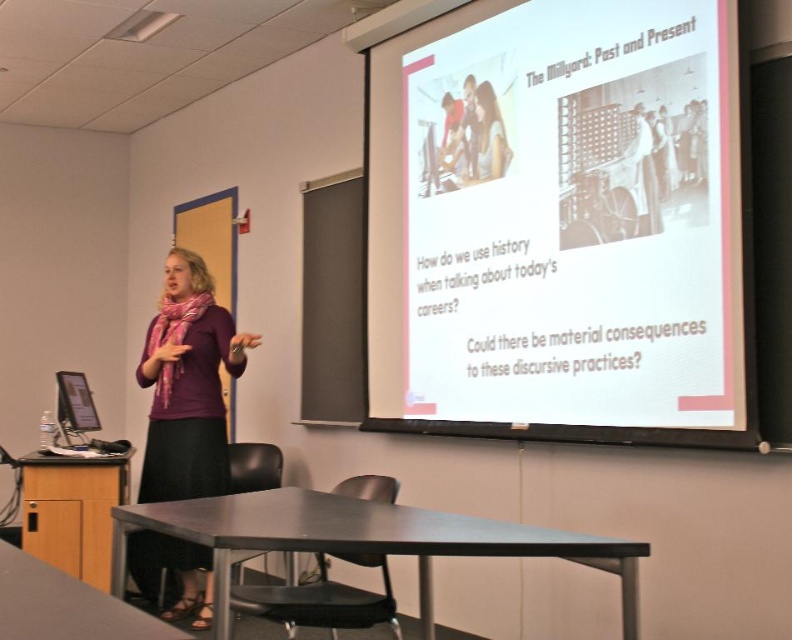
Question: Which object is positioned farthest from the light brown hair at upper center?

Choices:
 (A) matte black monitor at left
 (B) white paper at upper right

Answer: (A)

Question: Which point is farther from the camera taking this photo?

Choices:
 (A) (196, 342)
 (B) (486, 92)

Answer: (A)

Question: Which of the following is the farthest from the observer?

Choices:
 (A) light brown hair at upper center
 (B) matte purple shirt at center
 (C) white paper at upper right
 (D) matte black monitor at left

Answer: (D)

Question: Is matte purple shirt at center to the right of light brown hair at upper center from the viewer's perspective?

Choices:
 (A) yes
 (B) no

Answer: (B)

Question: Is matte purple shirt at center bigger than matte black monitor at left?

Choices:
 (A) yes
 (B) no

Answer: (A)

Question: Can you confirm if white paper at upper right is thinner than matte black monitor at left?

Choices:
 (A) no
 (B) yes

Answer: (A)